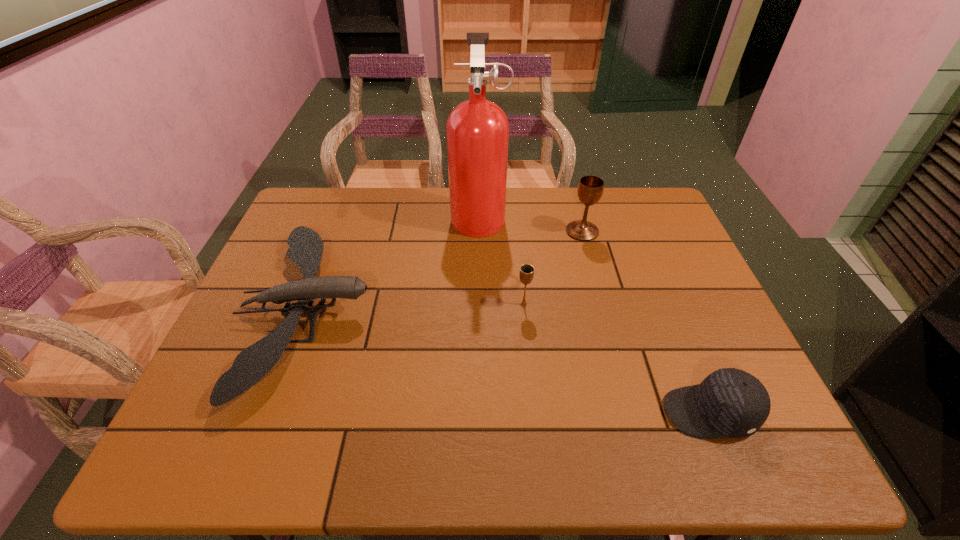
At what (x,y) coordinates should I click in order to perform the action: click on free space that is in between the left chalice and the drone. Please return your answer as a coordinate pair (x, y). The height and width of the screenshot is (540, 960). Looking at the image, I should click on (416, 308).

This screenshot has width=960, height=540. In order to click on vacant space that's between the fire extinguisher and the taller chalice in this screenshot , I will do `click(531, 223)`.

Where is `free space between the second tallest object and the third object from left to right`? This screenshot has width=960, height=540. free space between the second tallest object and the third object from left to right is located at coordinates (553, 268).

The width and height of the screenshot is (960, 540). Identify the location of vacant area that lies between the shorter chalice and the fourth shortest object. (553, 268).

Identify the location of free space between the second object from left to right and the leftmost object. Image resolution: width=960 pixels, height=540 pixels. (394, 263).

Identify the location of blank region between the fourth shortest object and the leftmost object. (444, 271).

Locate an element on the screen. vacant area that lies between the left chalice and the rightmost object is located at coordinates (616, 359).

Where is `free area in between the fire extinguisher and the drone`? free area in between the fire extinguisher and the drone is located at coordinates (394, 263).

The height and width of the screenshot is (540, 960). What are the coordinates of `object that can be found as the second closest to the rightmost object` in the screenshot? It's located at (590, 188).

Identify the location of the third closest object to the baseball cap. (477, 130).